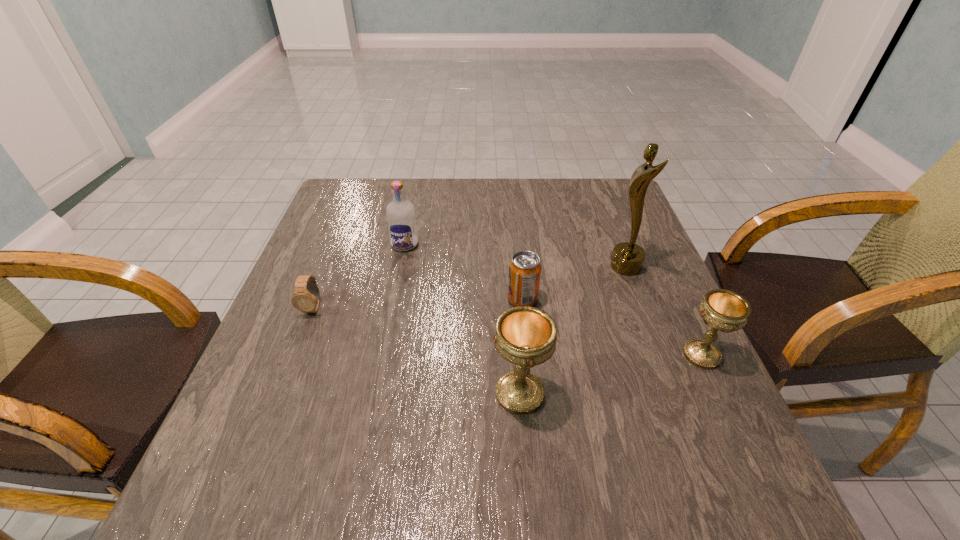
At what (x,y) coordinates should I click in order to perform the action: click on free space between the soda can and the second object from left to right. Please return your answer as a coordinate pair (x, y). The width and height of the screenshot is (960, 540). Looking at the image, I should click on (464, 272).

Locate an element on the screen. The image size is (960, 540). empty space between the watch and the taller chalice is located at coordinates (417, 350).

This screenshot has width=960, height=540. I want to click on free point between the second object from left to right and the second shortest object, so click(x=464, y=272).

Locate an element on the screen. Image resolution: width=960 pixels, height=540 pixels. empty location between the shorter chalice and the taller chalice is located at coordinates (611, 374).

Locate an element on the screen. The width and height of the screenshot is (960, 540). vacant space in between the fifth object from right to left and the left chalice is located at coordinates (463, 319).

The height and width of the screenshot is (540, 960). Find the location of `object that is the third closest one to the fifth tallest object`. object that is the third closest one to the fifth tallest object is located at coordinates (400, 213).

Select which object is the fourth closest to the fourth tallest object. Please provide its 2D coordinates. Your answer should be formatted as a tuple, i.e. [(x, y)], where the tuple contains the x and y coordinates of a point satisfying the conditions above.

[(400, 213)]

Where is `vacant area in the image that satisfies the following two spatial constraints: 1. on the back side of the fifth tallest object; 2. on the left side of the taller chalice`? This screenshot has height=540, width=960. vacant area in the image that satisfies the following two spatial constraints: 1. on the back side of the fifth tallest object; 2. on the left side of the taller chalice is located at coordinates (513, 299).

You are a GUI agent. You are given a task and a screenshot of the screen. Output one action in this format:
    pyautogui.click(x=<x>, y=<y>)
    Task: Click on the vacant area that satisfies the following two spatial constraints: 1. on the face of the rightmost object; 2. on the right side of the watch
    
    Given the screenshot: What is the action you would take?
    pyautogui.click(x=295, y=355)

At what (x,y) coordinates should I click in order to perform the action: click on vacant space that satisfies the following two spatial constraints: 1. on the face of the shortest object; 2. on the left side of the taller chalice. Please return your answer as a coordinate pair (x, y). The width and height of the screenshot is (960, 540). Looking at the image, I should click on (280, 394).